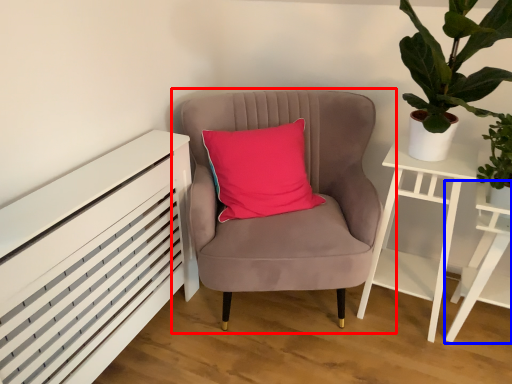
Question: Which object appears closest to the camera in this image, chair (highlighted by a red box) or table (highlighted by a blue box)?

Choices:
 (A) chair
 (B) table

Answer: (A)